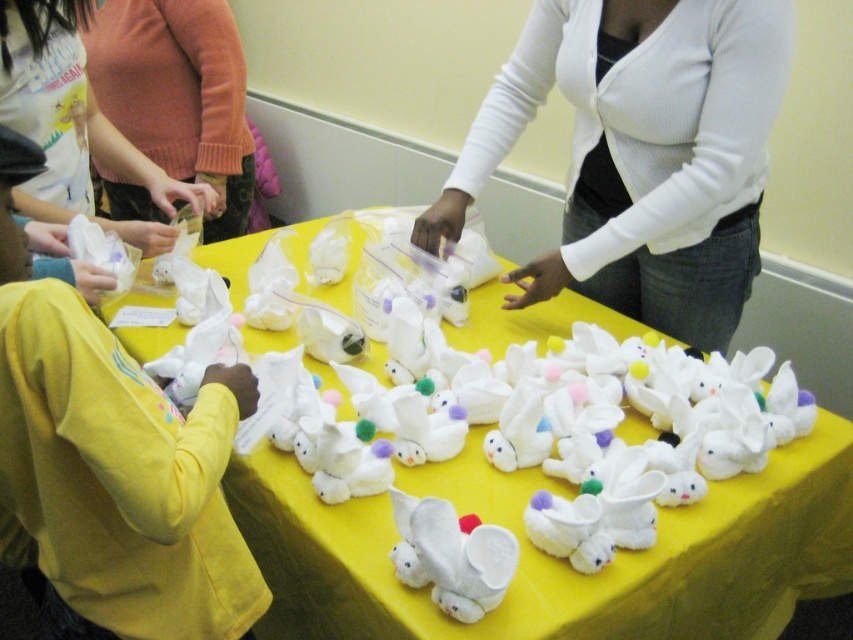
Question: Is white plush bunnies at center positioned behind matte orange sweater at upper left?

Choices:
 (A) yes
 (B) no

Answer: (B)

Question: Where is white plush bunnies at center located in relation to white plush rabbit at center in the image?

Choices:
 (A) below
 (B) above

Answer: (B)

Question: Which of these objects is positioned closest to the white plush rabbit at center?

Choices:
 (A) white ribbed sweater at upper center
 (B) white plush bunnies at center

Answer: (B)

Question: Which object appears closest to the camera in this image?

Choices:
 (A) matte orange sweater at upper left
 (B) white plush bunnies at center
 (C) white ribbed sweater at upper center
 (D) white plush rabbit at center

Answer: (D)

Question: Does white ribbed sweater at upper center have a lesser width compared to matte orange sweater at upper left?

Choices:
 (A) no
 (B) yes

Answer: (A)

Question: Which object appears farthest from the camera in this image?

Choices:
 (A) white plush rabbit at center
 (B) matte orange sweater at upper left
 (C) white plush bunnies at center

Answer: (B)